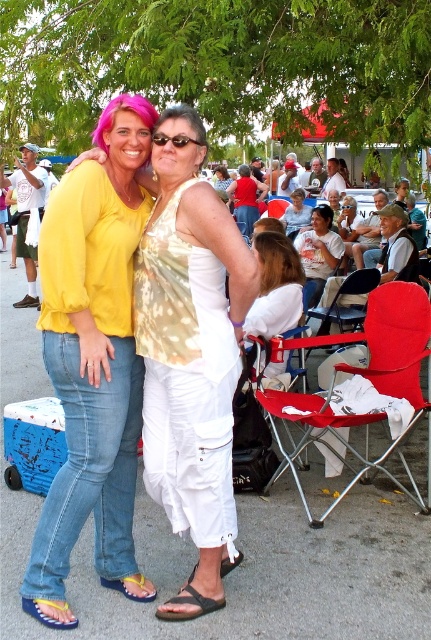
Does point (424, 128) come behind point (296, 296)?

No, it is in front of (296, 296).

The height and width of the screenshot is (640, 431). What are the coordinates of `green leafy tree at upper center` in the screenshot? It's located at (225, 65).

Between matte yellow blouse at center and blue fabric sandal at lower left, which one has more height?

With more height is matte yellow blouse at center.

Measure the distance between matte yellow blouse at center and camera.

matte yellow blouse at center and camera are 8.90 feet apart.

You are a GUI agent. You are given a task and a screenshot of the screen. Output one action in this format:
    pyautogui.click(x=<x>, y=<y>)
    Task: Click on the matte yellow blouse at center
    
    Given the screenshot: What is the action you would take?
    pyautogui.click(x=93, y=353)

Which is below, green leafy tree at upper center or red fabric folding chair at lower right?

red fabric folding chair at lower right is below.

Can you confirm if green leafy tree at upper center is taller than red fabric folding chair at lower right?

Yes, green leafy tree at upper center is taller than red fabric folding chair at lower right.

Does point (281, 54) lie behind point (293, 340)?

Yes, point (281, 54) is farther from viewer.

I want to click on green leafy tree at upper center, so click(x=225, y=65).